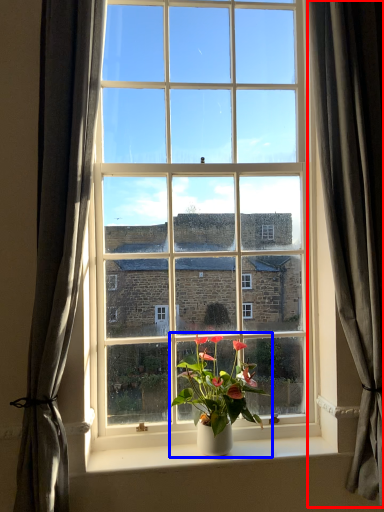
Question: Among these objects, which one is nearest to the camera, curtain (highlighted by a red box) or houseplant (highlighted by a blue box)?

Choices:
 (A) curtain
 (B) houseplant

Answer: (A)